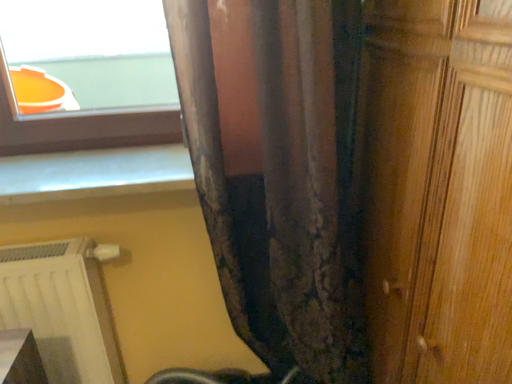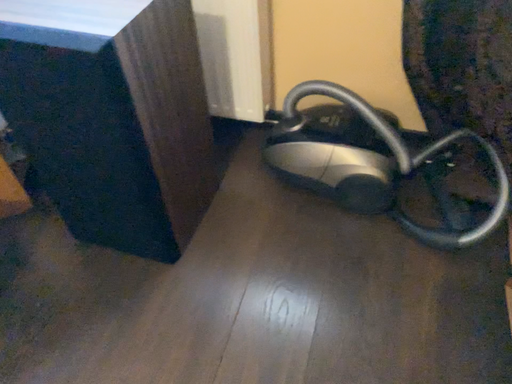
Question: How did the camera likely rotate when shooting the video?

Choices:
 (A) rotated left
 (B) rotated right

Answer: (A)